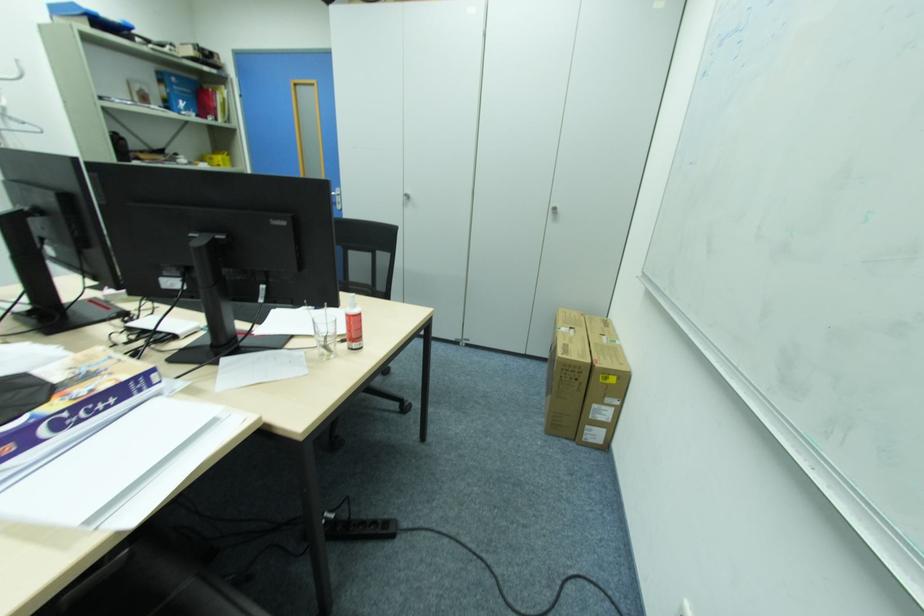
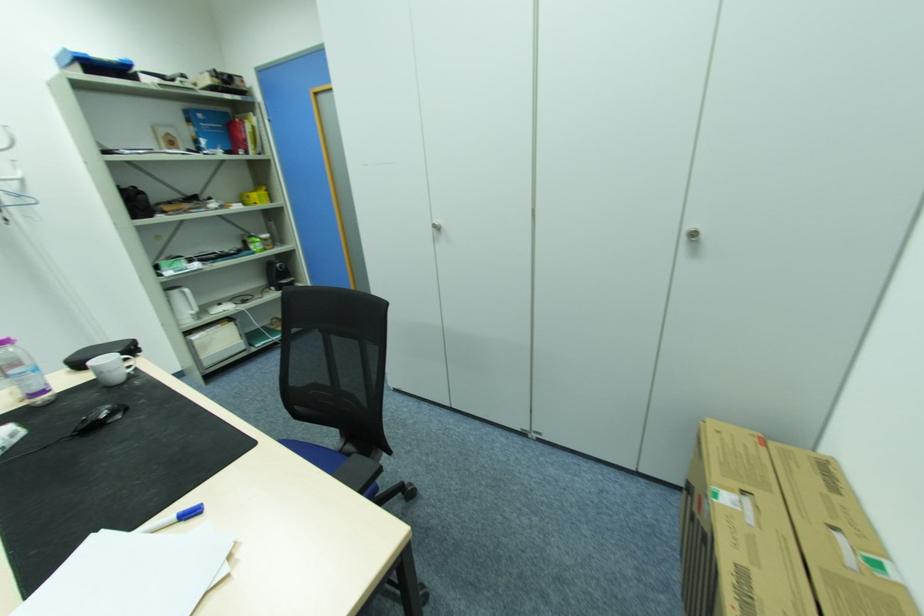
Question: The images are taken continuously from a first-person perspective. In which direction is your viewpoint rotating?

Choices:
 (A) Left
 (B) Right
 (C) Up
 (D) Down

Answer: (A)